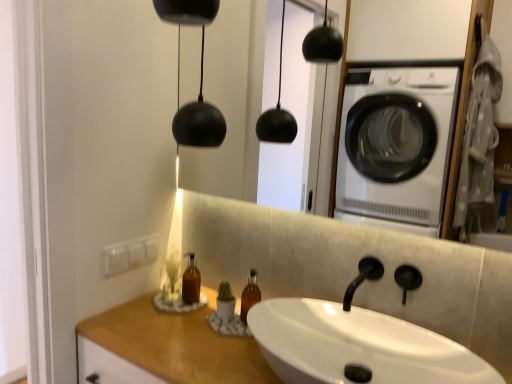
Question: From a real-world perspective, is black matte faucet at center positioned over wooden counter top at lower left based on gravity?

Choices:
 (A) yes
 (B) no

Answer: (A)

Question: Does black matte faucet at center have a greater height compared to wooden counter top at lower left?

Choices:
 (A) yes
 (B) no

Answer: (B)

Question: From a real-world perspective, is black matte faucet at center below wooden counter top at lower left?

Choices:
 (A) yes
 (B) no

Answer: (B)

Question: Does black matte faucet at center have a smaller size compared to wooden counter top at lower left?

Choices:
 (A) yes
 (B) no

Answer: (A)

Question: Does black matte faucet at center have a greater width compared to wooden counter top at lower left?

Choices:
 (A) no
 (B) yes

Answer: (A)

Question: Is wooden counter top at lower left wider or thinner than white glossy sink at center?

Choices:
 (A) wide
 (B) thin

Answer: (A)

Question: Is wooden counter top at lower left to the left or to the right of white glossy sink at center in the image?

Choices:
 (A) right
 (B) left

Answer: (B)

Question: From their relative heights in the image, would you say wooden counter top at lower left is taller or shorter than white glossy sink at center?

Choices:
 (A) tall
 (B) short

Answer: (A)

Question: From a real-world perspective, is wooden counter top at lower left physically located above or below white glossy sink at center?

Choices:
 (A) below
 (B) above

Answer: (A)

Question: Considering the relative positions of black matte faucet at center and translucent amber bottle at center in the image provided, is black matte faucet at center to the left or to the right of translucent amber bottle at center?

Choices:
 (A) left
 (B) right

Answer: (B)

Question: Considering the positions of black matte faucet at center and translucent amber bottle at center in the image, is black matte faucet at center wider or thinner than translucent amber bottle at center?

Choices:
 (A) wide
 (B) thin

Answer: (A)

Question: From the image's perspective, is black matte faucet at center located above or below translucent amber bottle at center?

Choices:
 (A) below
 (B) above

Answer: (B)

Question: Does point pyautogui.click(x=372, y=261) appear closer or farther from the camera than point pyautogui.click(x=193, y=253)?

Choices:
 (A) closer
 (B) farther

Answer: (A)

Question: Is translucent amber bottle at center taller or shorter than wooden counter top at lower left?

Choices:
 (A) short
 (B) tall

Answer: (A)

Question: Which is correct: translucent amber bottle at center is inside wooden counter top at lower left, or outside of it?

Choices:
 (A) outside
 (B) inside

Answer: (A)